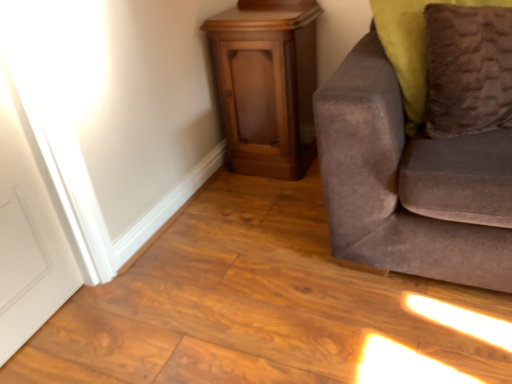
Question: Does brown fuzzy pillow at right lie behind suede gray couch at right?

Choices:
 (A) no
 (B) yes

Answer: (B)

Question: Is suede gray couch at right inside brown fuzzy pillow at right?

Choices:
 (A) no
 (B) yes

Answer: (A)

Question: Can you confirm if brown fuzzy pillow at right is positioned to the left of suede gray couch at right?

Choices:
 (A) no
 (B) yes

Answer: (A)

Question: Is brown fuzzy pillow at right not inside suede gray couch at right?

Choices:
 (A) yes
 (B) no

Answer: (B)

Question: Does brown fuzzy pillow at right have a lesser height compared to suede gray couch at right?

Choices:
 (A) yes
 (B) no

Answer: (A)

Question: From the image's perspective, does brown fuzzy pillow at right appear lower than suede gray couch at right?

Choices:
 (A) no
 (B) yes

Answer: (A)

Question: Is wooden cabinet at center next to brown fuzzy pillow at right and touching it?

Choices:
 (A) no
 (B) yes

Answer: (A)

Question: Is wooden cabinet at center smaller than brown fuzzy pillow at right?

Choices:
 (A) no
 (B) yes

Answer: (A)

Question: Considering the relative positions of wooden cabinet at center and brown fuzzy pillow at right in the image provided, is wooden cabinet at center to the left of brown fuzzy pillow at right from the viewer's perspective?

Choices:
 (A) no
 (B) yes

Answer: (B)

Question: Is brown fuzzy pillow at right located within wooden cabinet at center?

Choices:
 (A) yes
 (B) no

Answer: (B)

Question: Is wooden cabinet at center bigger than brown fuzzy pillow at right?

Choices:
 (A) yes
 (B) no

Answer: (A)

Question: Would you consider wooden cabinet at center to be distant from brown fuzzy pillow at right?

Choices:
 (A) no
 (B) yes

Answer: (A)

Question: Is the surface of wooden cabinet at center in direct contact with suede gray couch at right?

Choices:
 (A) no
 (B) yes

Answer: (A)